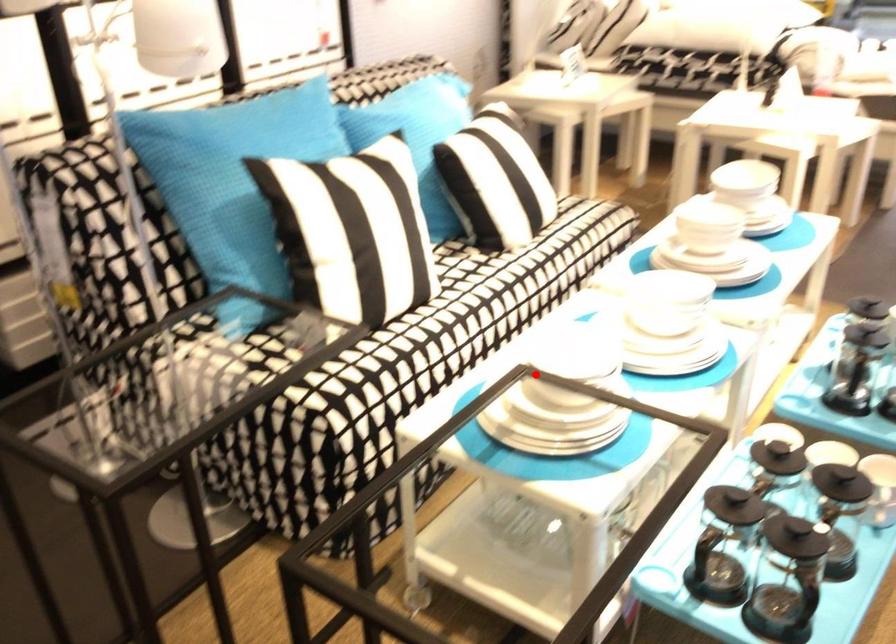
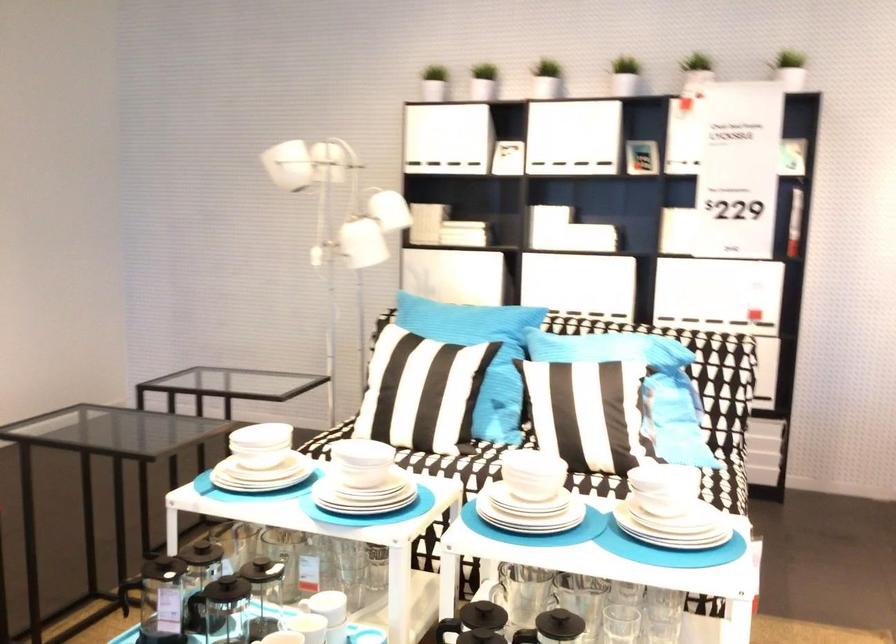
Question: I am providing you with two images of the same scene from different viewpoints. A red point is marked on the first image. Is the red point's position out of view in image 2?

Choices:
 (A) Yes
 (B) No

Answer: (B)